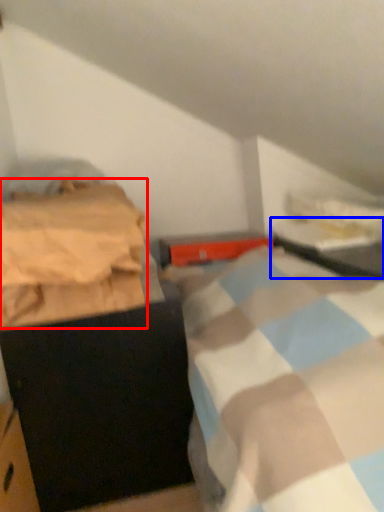
Question: Which point is further to the camera, blanket (highlighted by a red box) or table (highlighted by a blue box)?

Choices:
 (A) blanket
 (B) table

Answer: (B)